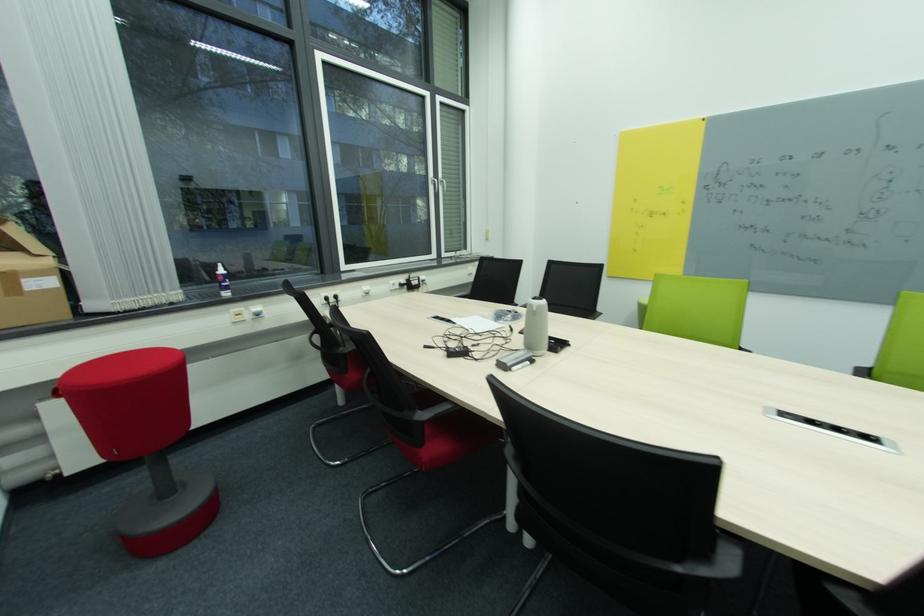
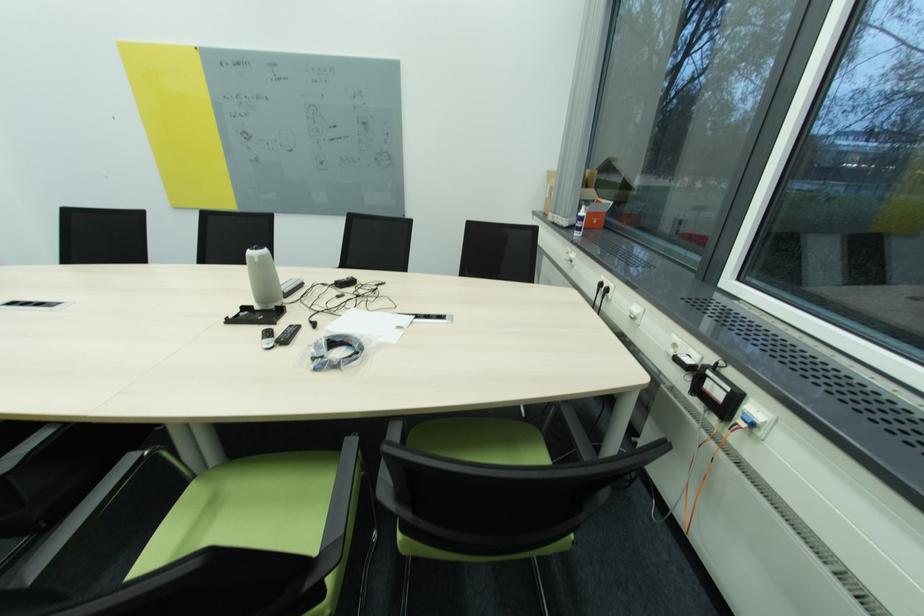
In the second image, find the point that corresponds to point (416, 281) in the first image.

(713, 373)